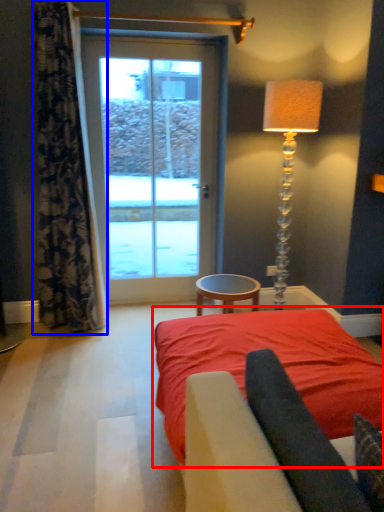
Question: Which object is further to the camera taking this photo, bed (highlighted by a red box) or curtain (highlighted by a blue box)?

Choices:
 (A) bed
 (B) curtain

Answer: (B)